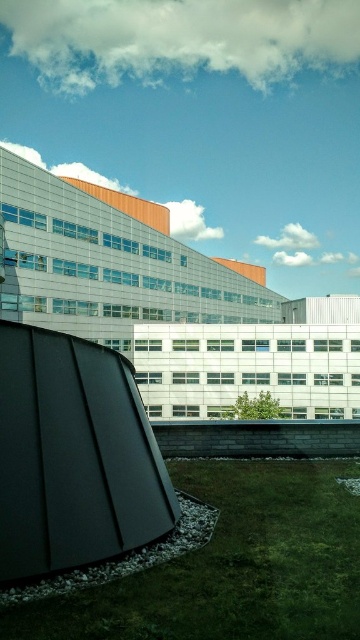
Between green grass at lower center and matte black sculpture at lower left, which one appears on the right side from the viewer's perspective?

green grass at lower center is more to the right.

Which is below, green grass at lower center or matte black sculpture at lower left?

Positioned lower is green grass at lower center.

Is point (222, 627) positioned behind point (10, 330)?

That is False.

Identify the location of green grass at lower center. (231, 564).